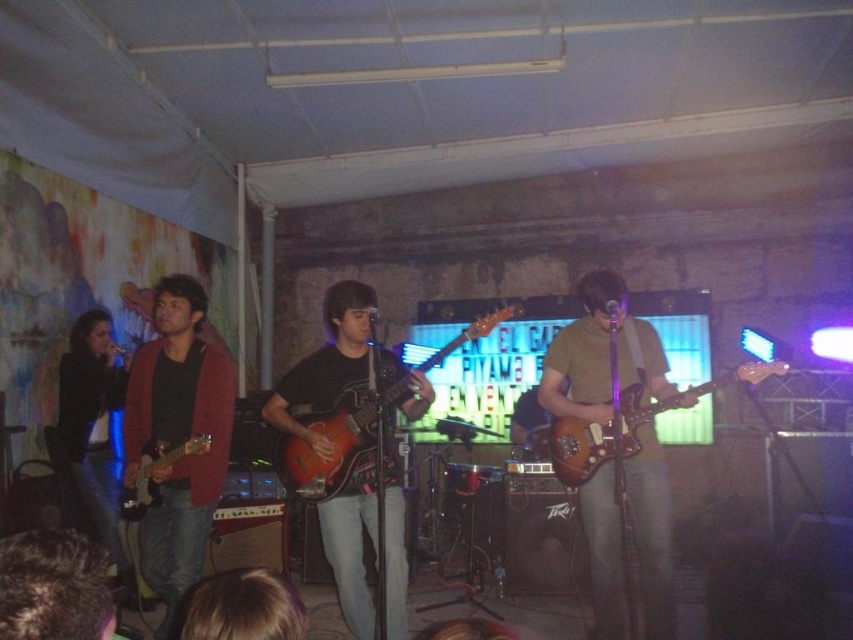
Question: Is matte black guitar at center to the left of matte orange electric guitar at left from the viewer's perspective?

Choices:
 (A) no
 (B) yes

Answer: (A)

Question: Which object appears closest to the camera in this image?

Choices:
 (A) matte black guitar at center
 (B) brushed metal guitar at left

Answer: (A)

Question: Which of these objects is positioned closest to the matte black guitar at center?

Choices:
 (A) black matte jacket at left
 (B) orange wood guitar at center
 (C) blonde hair at lower center
 (D) brown matte guitar at center

Answer: (B)

Question: Considering the relative positions of blonde hair at lower center and brown wooden guitar at center in the image provided, where is blonde hair at lower center located with respect to brown wooden guitar at center?

Choices:
 (A) left
 (B) right

Answer: (A)

Question: Is brown wooden guitar at center thinner than orange wood guitar at center?

Choices:
 (A) no
 (B) yes

Answer: (B)

Question: Which object appears farthest from the camera in this image?

Choices:
 (A) matte orange electric guitar at left
 (B) brown matte guitar at center

Answer: (B)